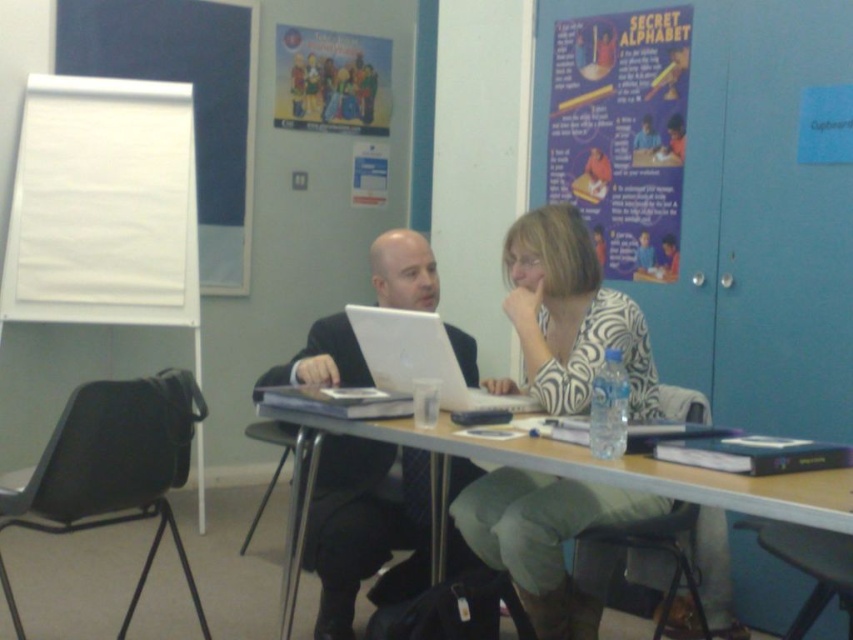
Who is more distant from viewer, (692, 468) or (277, 29)?

The point (277, 29) is behind.

Is point (785, 515) more distant than point (334, 70)?

No, it is not.

The width and height of the screenshot is (853, 640). In order to click on wooden table at center in this screenshot , I will do [561, 472].

How distant is matte paper poster at upper right from matte black suit at center?

matte paper poster at upper right is 4.19 feet from matte black suit at center.

Between matte paper poster at upper right and matte black suit at center, which one is positioned higher?

matte paper poster at upper right is above.

This screenshot has width=853, height=640. Describe the element at coordinates (622, 132) in the screenshot. I see `matte paper poster at upper right` at that location.

Identify the location of matte paper poster at upper right. This screenshot has width=853, height=640. (622, 132).

Who is positioned more to the left, white paperboard at left or matte black suit at center?

white paperboard at left

Which of these two, white paperboard at left or matte black suit at center, stands shorter?

matte black suit at center is shorter.

Is point (102, 81) positioned after point (378, 506)?

Yes.

This screenshot has height=640, width=853. Identify the location of white paperboard at left. (103, 205).